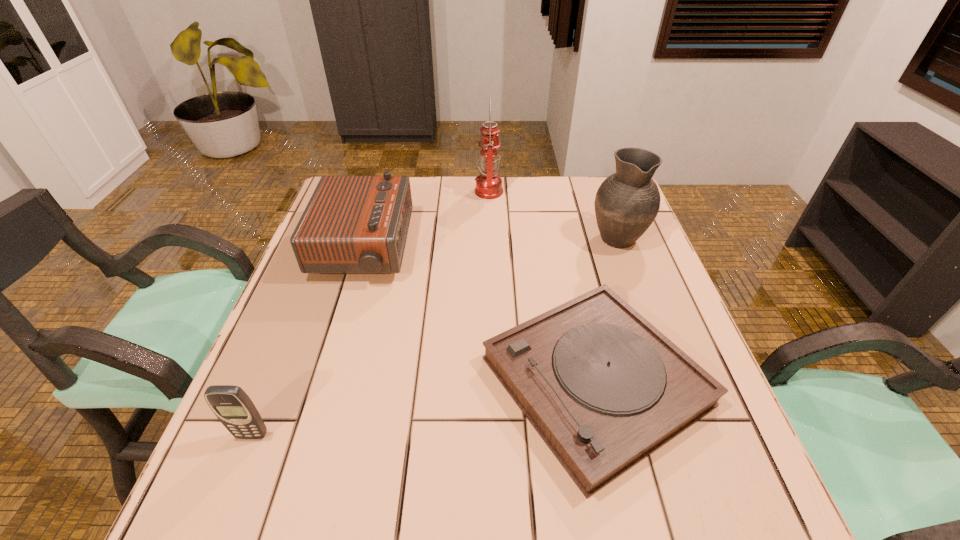
Locate an element on the screen. free space located on the front panel of the radio receiver is located at coordinates (545, 249).

Find the location of `vacant space situated on the screen of the cellular telephone`. vacant space situated on the screen of the cellular telephone is located at coordinates (217, 524).

Locate an element on the screen. free spot located 0.100m on the back of the shortest object is located at coordinates (570, 272).

The width and height of the screenshot is (960, 540). In order to click on oil lamp located at the far edge in this screenshot , I will do `click(489, 184)`.

This screenshot has height=540, width=960. What are the coordinates of `pitcher located at the far edge` in the screenshot? It's located at (627, 202).

Locate an element on the screen. The width and height of the screenshot is (960, 540). radio receiver that is at the far edge is located at coordinates (352, 224).

This screenshot has width=960, height=540. What are the coordinates of `object at the near edge` in the screenshot? It's located at (604, 388).

Locate an element on the screen. radio receiver at the left edge is located at coordinates (352, 224).

The height and width of the screenshot is (540, 960). I want to click on cellular telephone located at the left edge, so click(x=232, y=406).

The height and width of the screenshot is (540, 960). I want to click on pitcher present at the right edge, so click(627, 202).